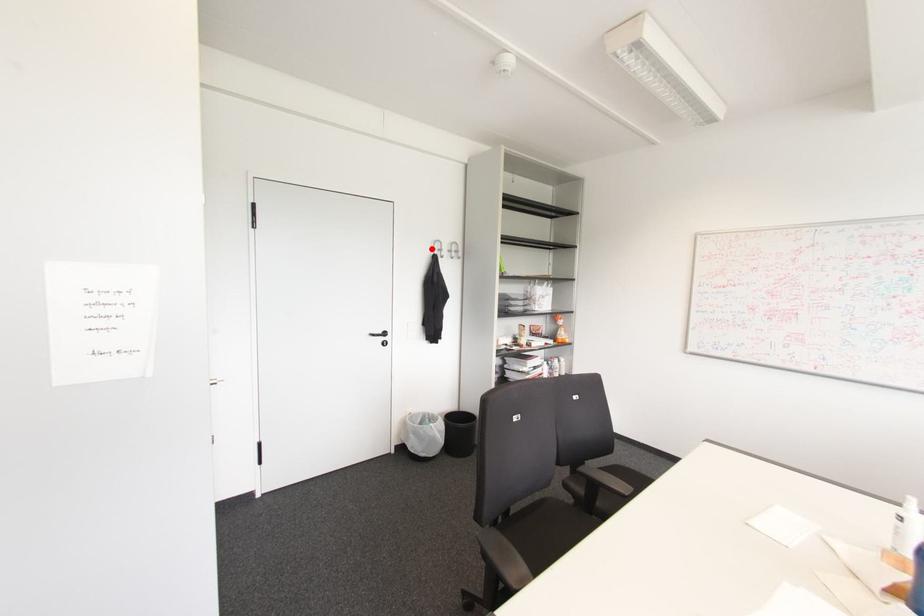
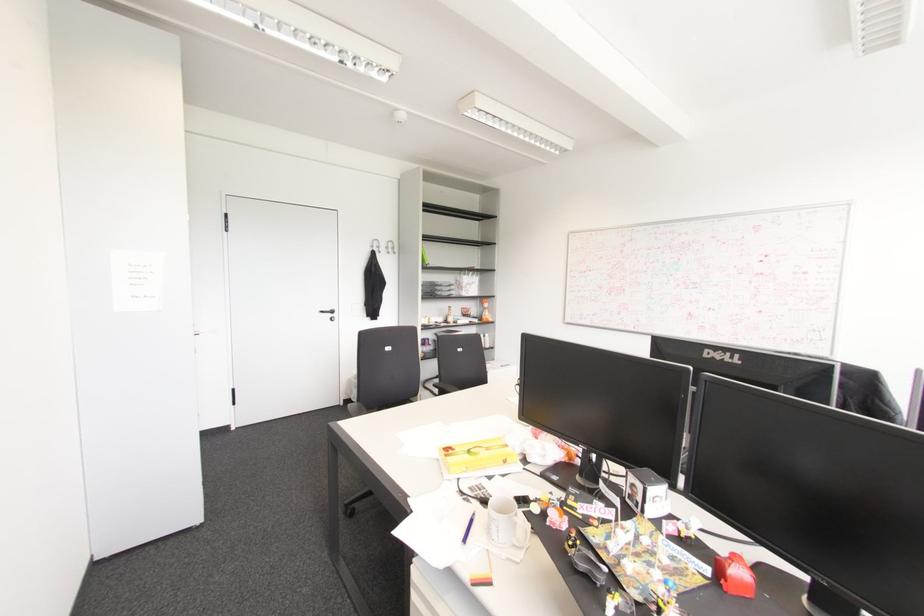
Locate, in the second image, the point that corresponds to the highlighted location in the first image.

(371, 246)